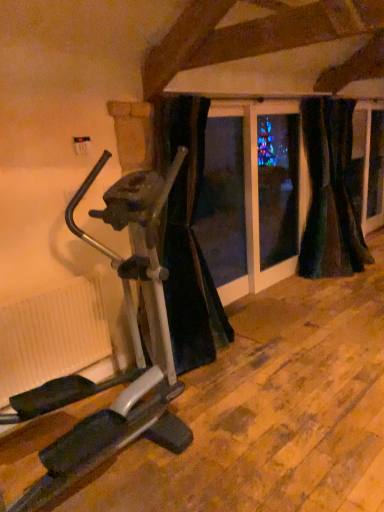
This screenshot has width=384, height=512. Describe the element at coordinates (347, 185) in the screenshot. I see `velvet dark green curtain at right, positioned as the 1th curtain in right-to-left order` at that location.

I want to click on velvet dark green curtain at right, positioned as the 1th curtain in right-to-left order, so click(347, 185).

Between velvet dark green curtain at right, acting as the second curtain starting from the left, and black velvet curtain at center, which is the 3th curtain in right-to-left order, which one appears on the left side from the viewer's perspective?

Positioned to the left is black velvet curtain at center, which is the 3th curtain in right-to-left order.

From a real-world perspective, is velvet dark green curtain at right, the 2th curtain positioned from the right, under black velvet curtain at center, which is counted as the first curtain, starting from the left?

Actually, velvet dark green curtain at right, the 2th curtain positioned from the right, is physically above black velvet curtain at center, which is counted as the first curtain, starting from the left, in the real world.

Is velvet dark green curtain at right, the 2th curtain positioned from the right, touching black velvet curtain at center, which is the 3th curtain in right-to-left order?

No, velvet dark green curtain at right, the 2th curtain positioned from the right, is not making contact with black velvet curtain at center, which is the 3th curtain in right-to-left order.

Is velvet dark green curtain at right, the 2th curtain positioned from the right, turned away from black velvet curtain at center, which is the 3th curtain in right-to-left order?

No, velvet dark green curtain at right, the 2th curtain positioned from the right,'s orientation is not away from black velvet curtain at center, which is the 3th curtain in right-to-left order.

Considering the sizes of black velvet curtain at center, which is counted as the first curtain, starting from the left, and velvet dark green curtain at right, positioned as the 1th curtain in right-to-left order, in the image, is black velvet curtain at center, which is counted as the first curtain, starting from the left, bigger or smaller than velvet dark green curtain at right, positioned as the 1th curtain in right-to-left order,?

Considering their sizes, black velvet curtain at center, which is counted as the first curtain, starting from the left, takes up more space than velvet dark green curtain at right, positioned as the 1th curtain in right-to-left order.

Considering the positions of objects black velvet curtain at center, which is the 3th curtain in right-to-left order, and velvet dark green curtain at right, positioned as the 1th curtain in right-to-left order, in the image provided, who is more to the left, black velvet curtain at center, which is the 3th curtain in right-to-left order, or velvet dark green curtain at right, positioned as the 1th curtain in right-to-left order,?

From the viewer's perspective, black velvet curtain at center, which is the 3th curtain in right-to-left order, appears more on the left side.

From a real-world perspective, who is located higher, black velvet curtain at center, which is the 3th curtain in right-to-left order, or velvet dark green curtain at right, marked as the third curtain in a left-to-right arrangement?

black velvet curtain at center, which is the 3th curtain in right-to-left order, from a real-world perspective.

Looking at this image, how many degrees apart are the facing directions of black velvet curtain at center, which is counted as the first curtain, starting from the left, and velvet dark green curtain at right, positioned as the 1th curtain in right-to-left order?

The angular difference between black velvet curtain at center, which is counted as the first curtain, starting from the left, and velvet dark green curtain at right, positioned as the 1th curtain in right-to-left order, is 0.00209 degrees.

Between black velvet curtain at center, which is counted as the first curtain, starting from the left, and velvet dark green curtain at right, acting as the second curtain starting from the left, which one appears on the left side from the viewer's perspective?

black velvet curtain at center, which is counted as the first curtain, starting from the left, is more to the left.

Between black velvet curtain at center, which is the 3th curtain in right-to-left order, and velvet dark green curtain at right, acting as the second curtain starting from the left, which one has larger width?

Wider between the two is velvet dark green curtain at right, acting as the second curtain starting from the left.

Considering the positions of point (203, 303) and point (334, 180), is point (203, 303) closer or farther from the camera than point (334, 180)?

Point (203, 303) is closer to the camera than point (334, 180).

Is black velvet curtain at center, which is the 3th curtain in right-to-left order, positioned with its back to velvet dark green curtain at right, the 2th curtain positioned from the right?

No, velvet dark green curtain at right, the 2th curtain positioned from the right, is not at the back of black velvet curtain at center, which is the 3th curtain in right-to-left order.

Is white ribbed radiator at lower left at the back of silver metallic stationary bicycle at left?

Yes, white ribbed radiator at lower left is at the back of silver metallic stationary bicycle at left.

Consider the image. How many degrees apart are the facing directions of silver metallic stationary bicycle at left and white ribbed radiator at lower left?

0.606 degrees.

Measure the distance between silver metallic stationary bicycle at left and white ribbed radiator at lower left.

silver metallic stationary bicycle at left and white ribbed radiator at lower left are 18.02 inches apart.

Where is `stationary bicycle that appears on the right of white ribbed radiator at lower left`? The image size is (384, 512). stationary bicycle that appears on the right of white ribbed radiator at lower left is located at coordinates (131, 332).

Can you confirm if black velvet curtain at center, which is the 3th curtain in right-to-left order, is smaller than silver metallic stationary bicycle at left?

Yes.

In the scene shown: From a real-world perspective, is black velvet curtain at center, which is the 3th curtain in right-to-left order, located beneath silver metallic stationary bicycle at left?

Incorrect, from a real-world perspective, black velvet curtain at center, which is the 3th curtain in right-to-left order, is higher than silver metallic stationary bicycle at left.

Would you say silver metallic stationary bicycle at left is part of black velvet curtain at center, which is the 3th curtain in right-to-left order,'s contents?

No.

Relative to silver metallic stationary bicycle at left, is black velvet curtain at center, which is the 3th curtain in right-to-left order, in front or behind?

Visually, black velvet curtain at center, which is the 3th curtain in right-to-left order, is located behind silver metallic stationary bicycle at left.

Which is behind, point (35, 328) or point (180, 186)?

Positioned behind is point (180, 186).

Based on the photo, from the image's perspective, is white ribbed radiator at lower left under black velvet curtain at center, which is the 3th curtain in right-to-left order?

Yes, from the image's perspective, white ribbed radiator at lower left is beneath black velvet curtain at center, which is the 3th curtain in right-to-left order.

Consider the image. Is white ribbed radiator at lower left situated inside black velvet curtain at center, which is the 3th curtain in right-to-left order, or outside?

white ribbed radiator at lower left is outside black velvet curtain at center, which is the 3th curtain in right-to-left order.

Considering the positions of objects white ribbed radiator at lower left and black velvet curtain at center, which is the 3th curtain in right-to-left order, in the image provided, who is more to the right, white ribbed radiator at lower left or black velvet curtain at center, which is the 3th curtain in right-to-left order,?

Positioned to the right is black velvet curtain at center, which is the 3th curtain in right-to-left order.

Is velvet dark green curtain at right, the 2th curtain positioned from the right, at the left side of white ribbed radiator at lower left?

No, velvet dark green curtain at right, the 2th curtain positioned from the right, is not to the left of white ribbed radiator at lower left.

Does velvet dark green curtain at right, the 2th curtain positioned from the right, lie in front of white ribbed radiator at lower left?

No, it is behind white ribbed radiator at lower left.

Is velvet dark green curtain at right, the 2th curtain positioned from the right, not near white ribbed radiator at lower left?

velvet dark green curtain at right, the 2th curtain positioned from the right, is far away from white ribbed radiator at lower left.

Who is taller, velvet dark green curtain at right, the 2th curtain positioned from the right, or white ribbed radiator at lower left?

velvet dark green curtain at right, the 2th curtain positioned from the right.

From a real-world perspective, starting from the velvet dark green curtain at right, acting as the second curtain starting from the left, which curtain is the 1st one below it? Please provide its 2D coordinates.

[(187, 237)]

From the velvet dark green curtain at right, marked as the third curtain in a left-to-right arrangement, count 2nd curtains forward and point to it. Please provide its 2D coordinates.

[(187, 237)]

From the image, which object appears to be nearer to velvet dark green curtain at right, acting as the second curtain starting from the left, black velvet curtain at center, which is the 3th curtain in right-to-left order, or white ribbed radiator at lower left?

Based on the image, black velvet curtain at center, which is the 3th curtain in right-to-left order, appears to be nearer to velvet dark green curtain at right, acting as the second curtain starting from the left.

From the image, which object appears to be nearer to black velvet curtain at center, which is counted as the first curtain, starting from the left, velvet dark green curtain at right, the 2th curtain positioned from the right, or silver metallic stationary bicycle at left?

silver metallic stationary bicycle at left is closer to black velvet curtain at center, which is counted as the first curtain, starting from the left.

Based on their spatial positions, is silver metallic stationary bicycle at left or velvet dark green curtain at right, the 2th curtain positioned from the right, further from white ribbed radiator at lower left?

velvet dark green curtain at right, the 2th curtain positioned from the right.

Which object lies further to the anchor point velvet dark green curtain at right, positioned as the 1th curtain in right-to-left order, silver metallic stationary bicycle at left or velvet dark green curtain at right, the 2th curtain positioned from the right?

The object further to velvet dark green curtain at right, positioned as the 1th curtain in right-to-left order, is silver metallic stationary bicycle at left.

When comparing their distances from velvet dark green curtain at right, the 2th curtain positioned from the right, does white ribbed radiator at lower left or velvet dark green curtain at right, positioned as the 1th curtain in right-to-left order, seem further?

Based on the image, white ribbed radiator at lower left appears to be further to velvet dark green curtain at right, the 2th curtain positioned from the right.

Estimate the real-world distances between objects in this image. Which object is further from white ribbed radiator at lower left, velvet dark green curtain at right, positioned as the 1th curtain in right-to-left order, or black velvet curtain at center, which is counted as the first curtain, starting from the left?

velvet dark green curtain at right, positioned as the 1th curtain in right-to-left order, is further to white ribbed radiator at lower left.

Based on their spatial positions, is velvet dark green curtain at right, positioned as the 1th curtain in right-to-left order, or silver metallic stationary bicycle at left further from black velvet curtain at center, which is the 3th curtain in right-to-left order?

velvet dark green curtain at right, positioned as the 1th curtain in right-to-left order, is positioned further to the anchor black velvet curtain at center, which is the 3th curtain in right-to-left order.

Based on the photo, considering their positions, is velvet dark green curtain at right, positioned as the 1th curtain in right-to-left order, positioned further to velvet dark green curtain at right, acting as the second curtain starting from the left, than silver metallic stationary bicycle at left?

Among the two, silver metallic stationary bicycle at left is located further to velvet dark green curtain at right, acting as the second curtain starting from the left.

What are the coordinates of `curtain positioned between black velvet curtain at center, which is the 3th curtain in right-to-left order, and velvet dark green curtain at right, marked as the third curtain in a left-to-right arrangement, from near to far` in the screenshot? It's located at pyautogui.click(x=330, y=192).

The width and height of the screenshot is (384, 512). I want to click on curtain between white ribbed radiator at lower left and velvet dark green curtain at right, acting as the second curtain starting from the left, from left to right, so click(x=187, y=237).

What are the coordinates of `radiator between silver metallic stationary bicycle at left and velvet dark green curtain at right, positioned as the 1th curtain in right-to-left order, in the front-back direction` in the screenshot? It's located at (53, 337).

At what (x,y) coordinates should I click in order to perform the action: click on radiator between silver metallic stationary bicycle at left and velvet dark green curtain at right, the 2th curtain positioned from the right, in the front-back direction. Please return your answer as a coordinate pair (x, y). The height and width of the screenshot is (512, 384). Looking at the image, I should click on (53, 337).